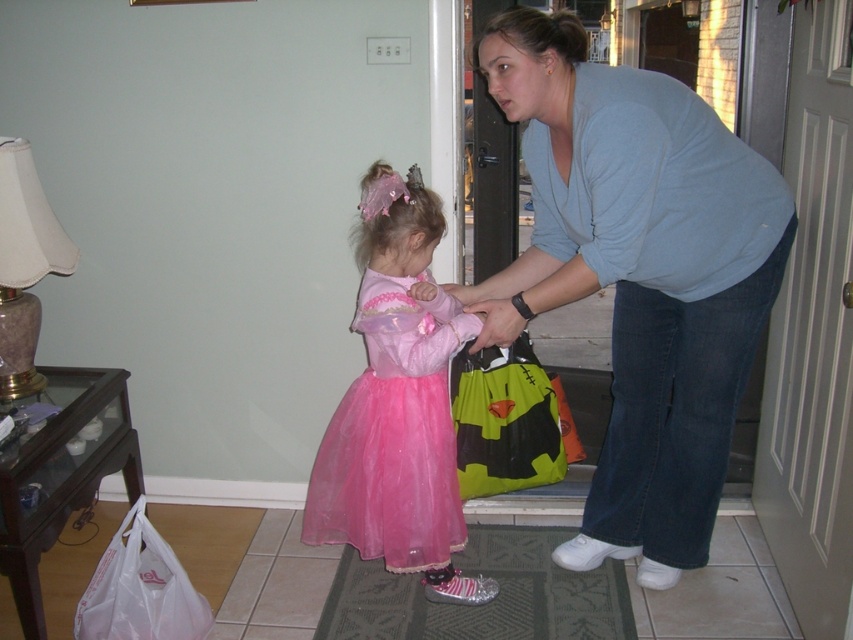
Between green textured mat at lower center and transparent plastic bag at lower left, which one appears on the left side from the viewer's perspective?

transparent plastic bag at lower left

Between point (463, 614) and point (108, 609), which one is positioned in front?

Point (108, 609)

At what (x,y) coordinates should I click in order to perform the action: click on green textured mat at lower center. Please return your answer as a coordinate pair (x, y). Looking at the image, I should click on (485, 604).

This screenshot has width=853, height=640. I want to click on light blue shirt at upper right, so click(637, 275).

Does light blue shirt at upper right appear on the left side of green fabric bag at center?

No, light blue shirt at upper right is not to the left of green fabric bag at center.

Identify the location of light blue shirt at upper right. The image size is (853, 640). (637, 275).

Can you confirm if light blue shirt at upper right is positioned to the left of pink tulle dress at center?

In fact, light blue shirt at upper right is to the right of pink tulle dress at center.

Does point (625, 131) come in front of point (390, 461)?

That is True.

This screenshot has height=640, width=853. Identify the location of light blue shirt at upper right. (637, 275).

You are a GUI agent. You are given a task and a screenshot of the screen. Output one action in this format:
    pyautogui.click(x=<x>, y=<y>)
    Task: Click on the light blue shirt at upper right
    The image size is (853, 640).
    Given the screenshot: What is the action you would take?
    pyautogui.click(x=637, y=275)